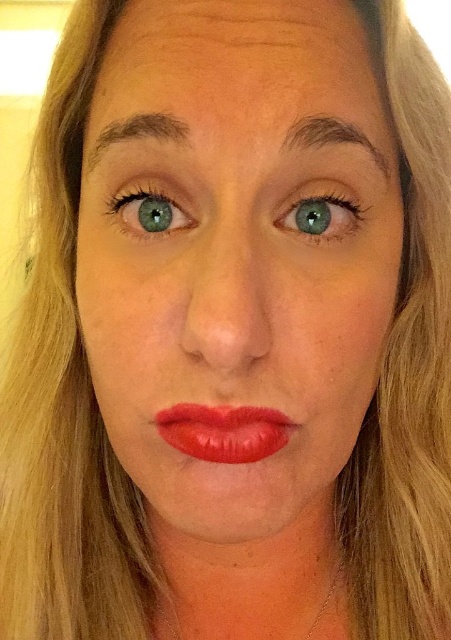
Question: Does green matte eye at upper center appear under dark brown hair at upper center?

Choices:
 (A) yes
 (B) no

Answer: (A)

Question: Is the position of shiny red lipstick at center more distant than that of dark brown eyebrow at upper left?

Choices:
 (A) no
 (B) yes

Answer: (B)

Question: Which point is farther to the camera?

Choices:
 (A) (299, 189)
 (B) (231, 266)

Answer: (A)

Question: In this image, where is green matte eye at upper center located relative to dark brown eyebrow at upper left?

Choices:
 (A) above
 (B) below

Answer: (B)

Question: Which object appears closest to the camera in this image?

Choices:
 (A) dark brown eyebrow at upper left
 (B) dark brown hair at upper center

Answer: (A)

Question: Estimate the real-world distances between objects in this image. Which object is closer to the green matte eye at center?

Choices:
 (A) dark brown eyebrow at upper left
 (B) dark brown hair at upper center

Answer: (B)